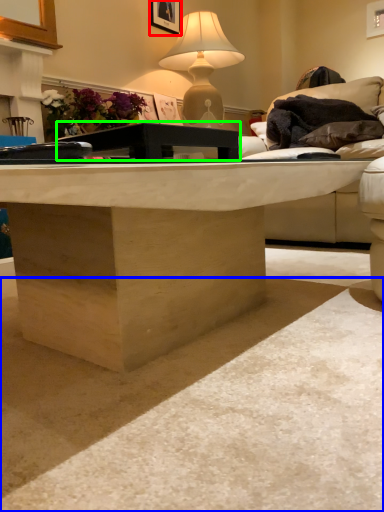
Question: Which is farther away from picture frame (highlighted by a red box)? concrete (highlighted by a blue box) or table (highlighted by a green box)?

Choices:
 (A) concrete
 (B) table

Answer: (A)